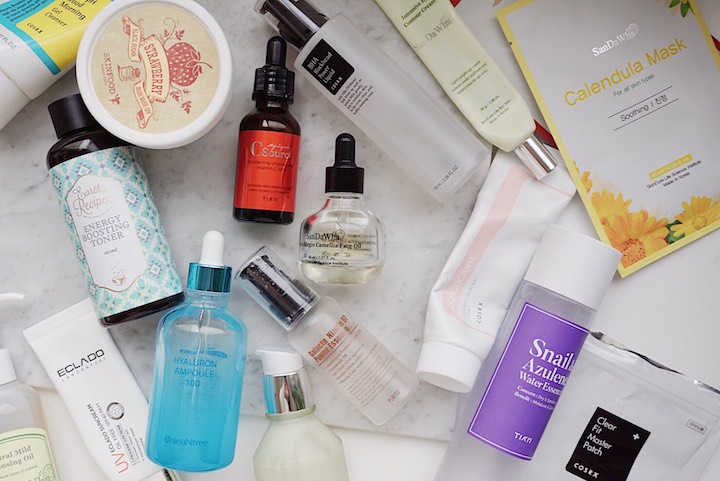
Where is `surface`? This screenshot has width=720, height=481. surface is located at coordinates tap(400, 273).